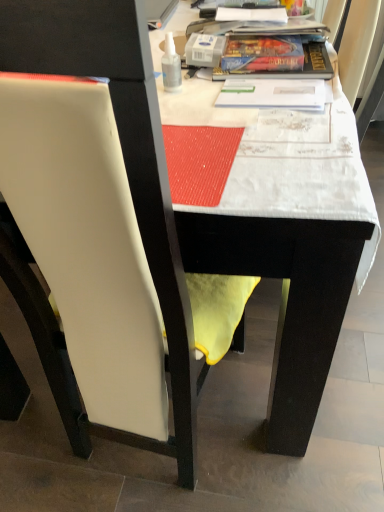
Question: Is white fabric table at upper center beside white leather chair at left?

Choices:
 (A) no
 (B) yes

Answer: (A)

Question: Does white fabric table at upper center have a greater width compared to white leather chair at left?

Choices:
 (A) yes
 (B) no

Answer: (A)

Question: Is white leather chair at left inside white fabric table at upper center?

Choices:
 (A) no
 (B) yes

Answer: (A)

Question: Are white fabric table at upper center and white leather chair at left far apart?

Choices:
 (A) no
 (B) yes

Answer: (A)

Question: From a real-world perspective, is white fabric table at upper center positioned under white leather chair at left based on gravity?

Choices:
 (A) yes
 (B) no

Answer: (A)

Question: Relative to transparent plastic bottle at upper center, is white fabric table at upper center in front or behind?

Choices:
 (A) behind
 (B) front

Answer: (B)

Question: Considering the positions of white fabric table at upper center and transparent plastic bottle at upper center in the image, is white fabric table at upper center bigger or smaller than transparent plastic bottle at upper center?

Choices:
 (A) small
 (B) big

Answer: (B)

Question: Considering the relative positions of white fabric table at upper center and transparent plastic bottle at upper center in the image provided, is white fabric table at upper center to the left or to the right of transparent plastic bottle at upper center?

Choices:
 (A) left
 (B) right

Answer: (B)

Question: From the image's perspective, is white fabric table at upper center located above or below transparent plastic bottle at upper center?

Choices:
 (A) below
 (B) above

Answer: (A)

Question: In terms of width, does white leather chair at left look wider or thinner when compared to transparent plastic bottle at upper center?

Choices:
 (A) wide
 (B) thin

Answer: (A)

Question: Is point (198, 345) positioned closer to the camera than point (170, 62)?

Choices:
 (A) farther
 (B) closer

Answer: (B)

Question: Considering the positions of white leather chair at left and transparent plastic bottle at upper center in the image, is white leather chair at left taller or shorter than transparent plastic bottle at upper center?

Choices:
 (A) short
 (B) tall

Answer: (B)

Question: Relative to transparent plastic bottle at upper center, is white leather chair at left in front or behind?

Choices:
 (A) behind
 (B) front

Answer: (B)

Question: In terms of height, does white leather chair at left look taller or shorter compared to white fabric table at upper center?

Choices:
 (A) short
 (B) tall

Answer: (B)

Question: From the image's perspective, is white leather chair at left located above or below white fabric table at upper center?

Choices:
 (A) below
 (B) above

Answer: (A)